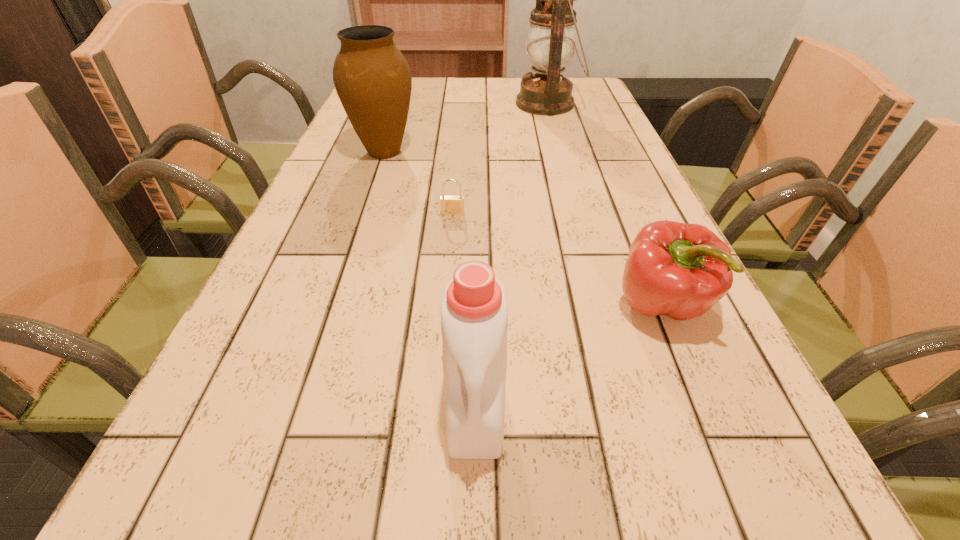
The height and width of the screenshot is (540, 960). Find the location of `vacant area located 0.220m on the left of the tallest object`. vacant area located 0.220m on the left of the tallest object is located at coordinates (444, 104).

Where is `vacant space located on the front of the leftmost object`? The width and height of the screenshot is (960, 540). vacant space located on the front of the leftmost object is located at coordinates (361, 220).

Locate an element on the screen. The height and width of the screenshot is (540, 960). free space located on the back of the fourth farthest object is located at coordinates (635, 239).

I want to click on vacant region located on the front-facing side of the padlock, so click(x=444, y=326).

Where is `object at the far edge`? This screenshot has width=960, height=540. object at the far edge is located at coordinates (551, 35).

Where is `object that is at the left edge`? object that is at the left edge is located at coordinates (372, 78).

Where is `lantern located in the right edge section of the desktop`? lantern located in the right edge section of the desktop is located at coordinates [551, 35].

This screenshot has height=540, width=960. Identify the location of pepper that is positioned at the right edge. (679, 270).

Find the location of a particular element. The height and width of the screenshot is (540, 960). object situated at the far right corner is located at coordinates (551, 35).

I want to click on free location at the far edge, so click(x=476, y=98).